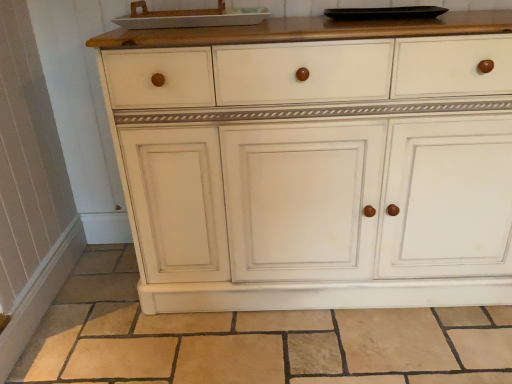
Question: Is beige tile at lower center not inside white glossy tray at upper center?

Choices:
 (A) yes
 (B) no

Answer: (A)

Question: Is beige tile at lower center positioned with its back to white glossy tray at upper center?

Choices:
 (A) yes
 (B) no

Answer: (B)

Question: Can you confirm if beige tile at lower center is thinner than white glossy tray at upper center?

Choices:
 (A) yes
 (B) no

Answer: (B)

Question: Is beige tile at lower center far from white glossy tray at upper center?

Choices:
 (A) no
 (B) yes

Answer: (B)

Question: From a real-world perspective, is beige tile at lower center physically below white glossy tray at upper center?

Choices:
 (A) yes
 (B) no

Answer: (A)

Question: Are beige tile at lower center and white glossy tray at upper center beside each other?

Choices:
 (A) yes
 (B) no

Answer: (B)

Question: Can you confirm if white glossy tray at upper center is bigger than white painted wood cabinet at center?

Choices:
 (A) yes
 (B) no

Answer: (B)

Question: Is white glossy tray at upper center thinner than white painted wood cabinet at center?

Choices:
 (A) yes
 (B) no

Answer: (A)

Question: Considering the relative sizes of white glossy tray at upper center and white painted wood cabinet at center in the image provided, is white glossy tray at upper center taller than white painted wood cabinet at center?

Choices:
 (A) no
 (B) yes

Answer: (A)

Question: From the image's perspective, does white glossy tray at upper center appear higher than white painted wood cabinet at center?

Choices:
 (A) yes
 (B) no

Answer: (A)

Question: Is white glossy tray at upper center aimed at white painted wood cabinet at center?

Choices:
 (A) no
 (B) yes

Answer: (A)

Question: Is white glossy tray at upper center next to white painted wood cabinet at center and touching it?

Choices:
 (A) no
 (B) yes

Answer: (A)

Question: Considering the relative positions of white painted wood cabinet at center and white glossy tray at upper center in the image provided, is white painted wood cabinet at center in front of white glossy tray at upper center?

Choices:
 (A) no
 (B) yes

Answer: (B)